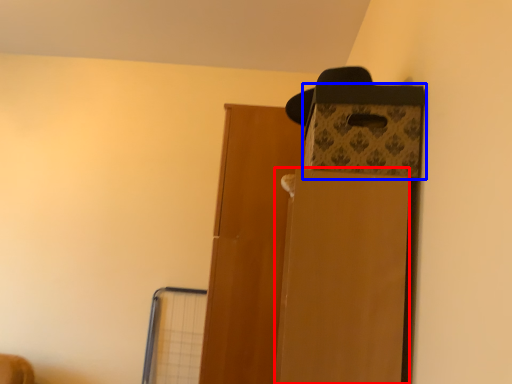
Question: Which point is further to the camera, cardboard box (highlighted by a red box) or storage box (highlighted by a blue box)?

Choices:
 (A) cardboard box
 (B) storage box

Answer: (B)